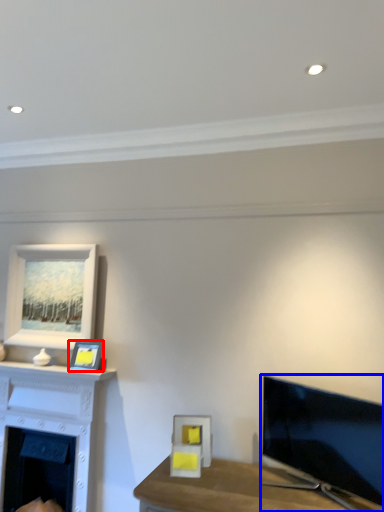
Question: Which point is closer to the camera, picture frame (highlighted by a red box) or television (highlighted by a blue box)?

Choices:
 (A) picture frame
 (B) television

Answer: (B)